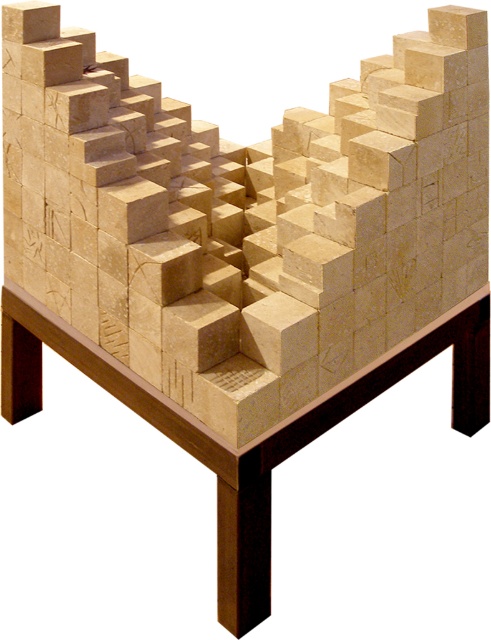
Is natural wood cube at center shorter than wooden table at center?

In fact, natural wood cube at center may be taller than wooden table at center.

Does natural wood cube at center have a smaller size compared to wooden table at center?

No, natural wood cube at center is not smaller than wooden table at center.

Between point (25, 157) and point (37, 330), which one is positioned in front?

Point (25, 157) is more forward.

At what (x,y) coordinates should I click in order to perform the action: click on natural wood cube at center. Please return your answer as a coordinate pair (x, y). This screenshot has height=640, width=491. Looking at the image, I should click on (240, 221).